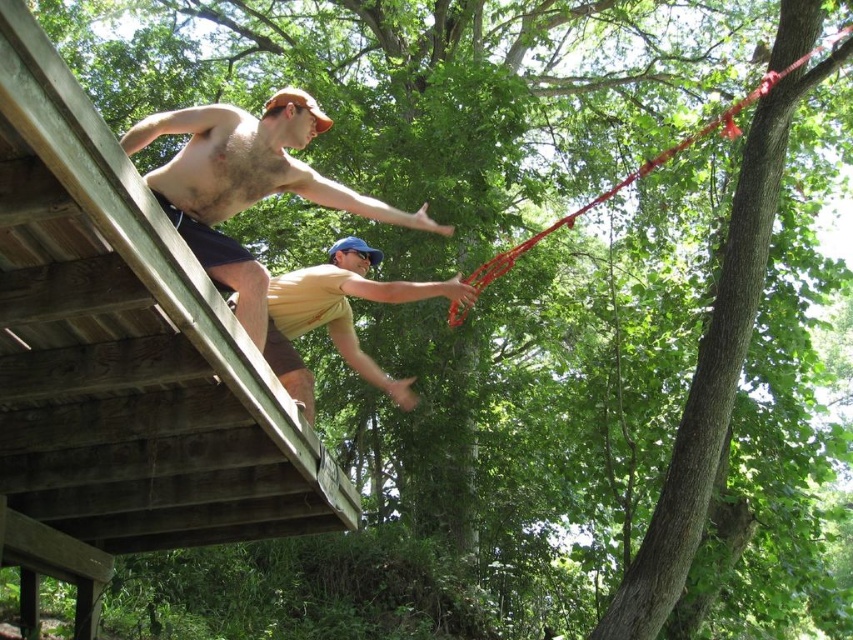
You are planning to set up a new slackline between the shiny metallic pole at upper center and the red nylon rope at upper right. The recommended minimum distance for a safe slackline setup is 5 meters. Based on the scene description, is this setup within the recommended safety guidelines?

The shiny metallic pole at upper center is 5.50 meters from the red nylon rope at upper right. Since the recommended minimum distance is 5 meters, this setup is within the recommended safety guidelines as the distance exceeds the minimum requirement.

You are standing in the wooded area and want to place a small flag at the point closer to you between the two points, point [192,161] and point [289,310]. Which point should you choose?

Point [192,161] is closer to the camera than point [289,310], so you should choose point [192,161] to place the flag.